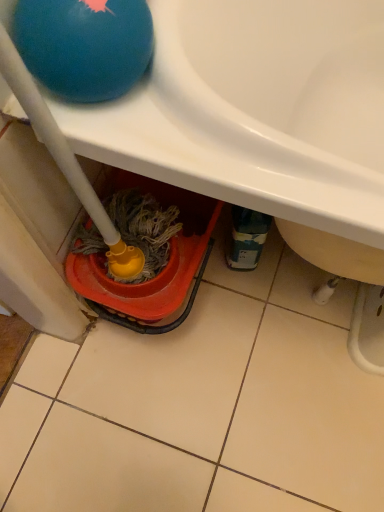
Question: Based on their sizes in the image, would you say blue rubber ball at upper left is bigger or smaller than white glossy sink at upper center?

Choices:
 (A) small
 (B) big

Answer: (A)

Question: From a real-world perspective, is blue rubber ball at upper left above or below white glossy sink at upper center?

Choices:
 (A) above
 (B) below

Answer: (A)

Question: Is blue rubber ball at upper left wider or thinner than white glossy sink at upper center?

Choices:
 (A) thin
 (B) wide

Answer: (A)

Question: From a real-world perspective, relative to blue rubber ball at upper left, is white glossy sink at upper center vertically above or below?

Choices:
 (A) above
 (B) below

Answer: (B)

Question: Would you say white glossy sink at upper center is inside or outside blue rubber ball at upper left?

Choices:
 (A) outside
 (B) inside

Answer: (A)

Question: In terms of height, does white glossy sink at upper center look taller or shorter compared to blue rubber ball at upper left?

Choices:
 (A) short
 (B) tall

Answer: (B)

Question: From the image's perspective, is white glossy sink at upper center above or below blue rubber ball at upper left?

Choices:
 (A) above
 (B) below

Answer: (A)